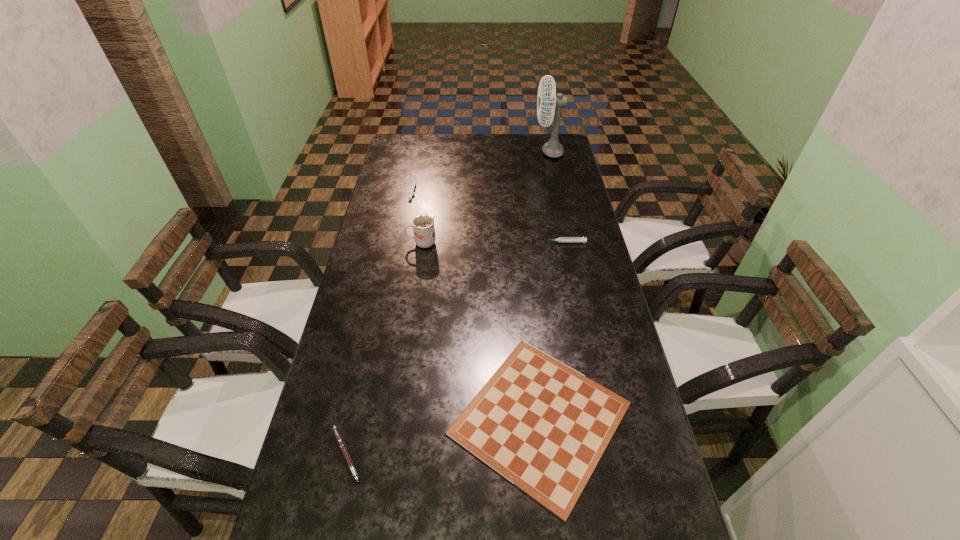
Where is `blank space at the far left corner of the desktop`? blank space at the far left corner of the desktop is located at coordinates (407, 151).

Identify the location of vacant area at the far right corner. The width and height of the screenshot is (960, 540). (565, 138).

The width and height of the screenshot is (960, 540). In order to click on free space between the cup and the pen in this screenshot , I will do `click(384, 348)`.

Identify the location of free spot between the nearer syringe and the checkerboard. The image size is (960, 540). (553, 330).

The width and height of the screenshot is (960, 540). What are the coordinates of `unoccupied area between the fifth shortest object and the right syringe` in the screenshot? It's located at (493, 242).

I want to click on blank region between the fifth tallest object and the fifth shortest object, so coord(384,348).

Locate an element on the screen. The width and height of the screenshot is (960, 540). free space between the farther syringe and the shortest object is located at coordinates (476, 304).

This screenshot has width=960, height=540. What are the coordinates of `free space between the tallest object and the pen` in the screenshot? It's located at (447, 303).

Where is `free space between the fan and the shortest object`? Image resolution: width=960 pixels, height=540 pixels. free space between the fan and the shortest object is located at coordinates (544, 285).

In order to click on vacant area between the fifth nearest object and the checkerboard in this screenshot , I will do `click(476, 304)`.